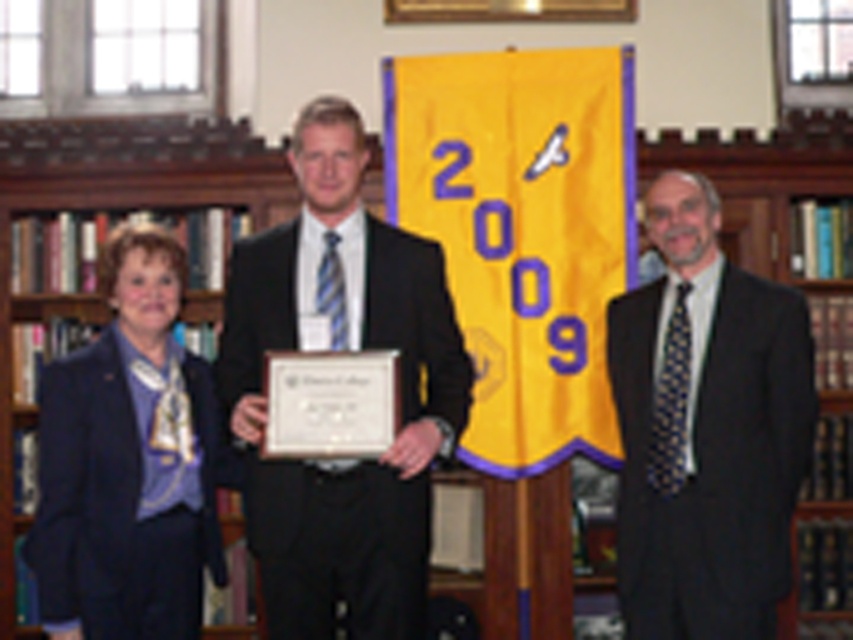
Question: Which point appears closest to the camera in this image?

Choices:
 (A) (799, 371)
 (B) (134, 595)

Answer: (B)

Question: Can you confirm if matte black suit at center is bigger than dark gray suit at right?

Choices:
 (A) no
 (B) yes

Answer: (B)

Question: Is dark gray suit at right bigger than matte black blazer at left?

Choices:
 (A) no
 (B) yes

Answer: (B)

Question: Which point is farther from the camera taking this photo?

Choices:
 (A) (39, 600)
 (B) (289, 625)
 (C) (637, 353)

Answer: (C)

Question: Can you confirm if matte black suit at center is positioned below dark gray suit at right?

Choices:
 (A) no
 (B) yes

Answer: (A)

Question: Which object is farther from the camera taking this photo?

Choices:
 (A) matte black blazer at left
 (B) matte black suit at center
 (C) dark gray suit at right

Answer: (C)